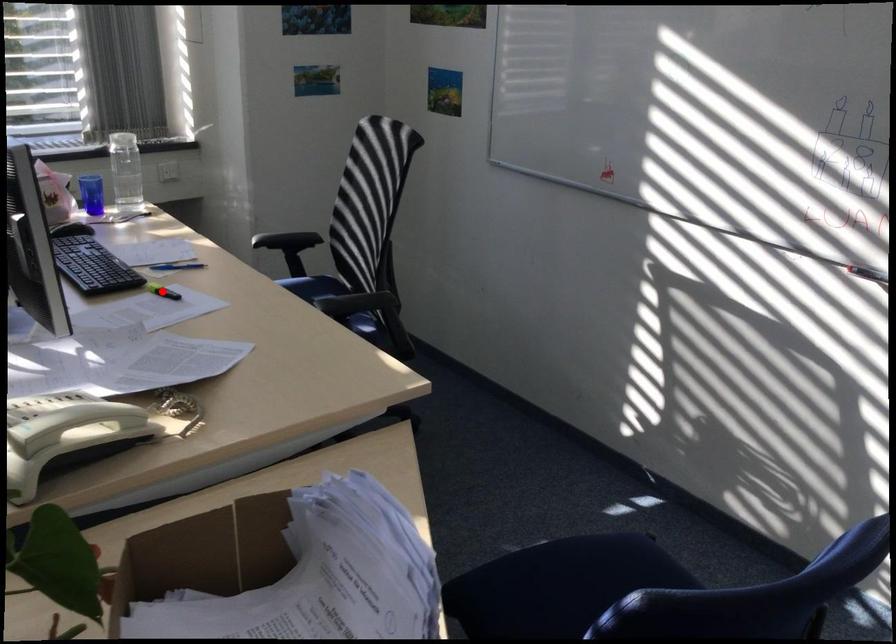
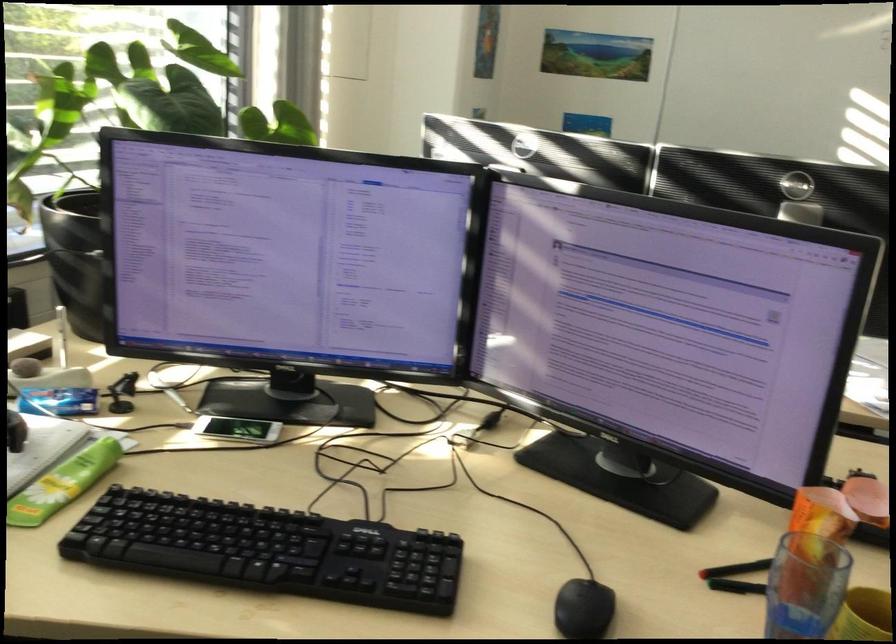
Question: I am providing you with two images of the same scene from different viewpoints. A red point is marked on the first image. At the location where the point appears in image 1, is it still visible in image 2?

Choices:
 (A) Yes
 (B) No

Answer: (B)